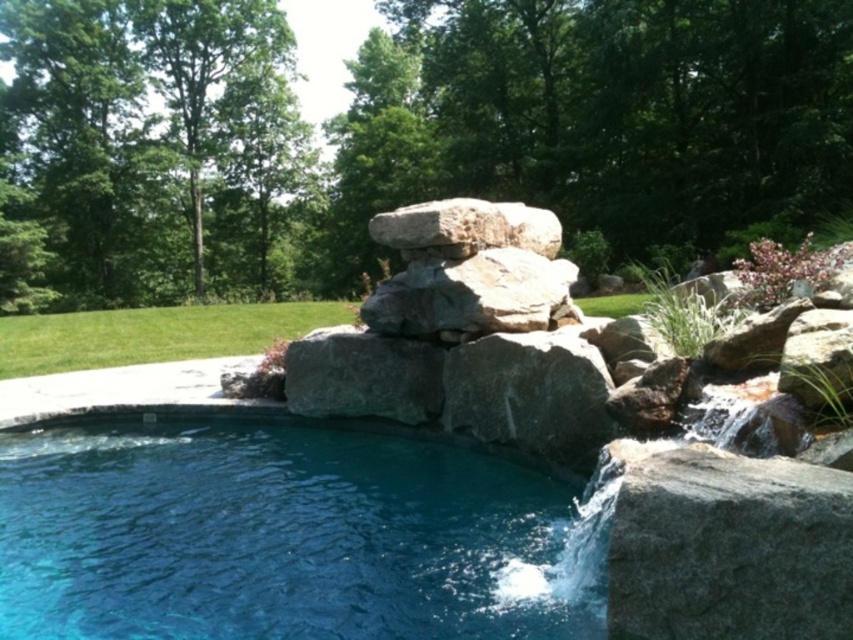
Can you confirm if natural stone rock formation at center is shorter than green grass at lower left?

Incorrect, natural stone rock formation at center's height does not fall short of green grass at lower left's.

Who is more distant from viewer, (444, 280) or (316, 321)?

The point (316, 321) is behind.

At what (x,y) coordinates should I click in order to perform the action: click on natural stone rock formation at center. Please return your answer as a coordinate pair (x, y). This screenshot has height=640, width=853. Looking at the image, I should click on (463, 337).

Where is `green leafy tree at upper left`? green leafy tree at upper left is located at coordinates (149, 152).

Between green leafy tree at upper left and green grass at lower left, which one appears on the left side from the viewer's perspective?

green leafy tree at upper left is more to the left.

Does point (250, 198) come behind point (13, 337)?

Yes.

Find the location of a particular element. green leafy tree at upper left is located at coordinates (149, 152).

Can you confirm if green leafy tree at upper center is thinner than green grass at lower left?

No.

Does green leafy tree at upper center lie in front of green grass at lower left?

No, green leafy tree at upper center is behind green grass at lower left.

Which is behind, point (56, 32) or point (186, 330)?

Positioned behind is point (56, 32).

Image resolution: width=853 pixels, height=640 pixels. I want to click on green leafy tree at upper center, so click(x=404, y=136).